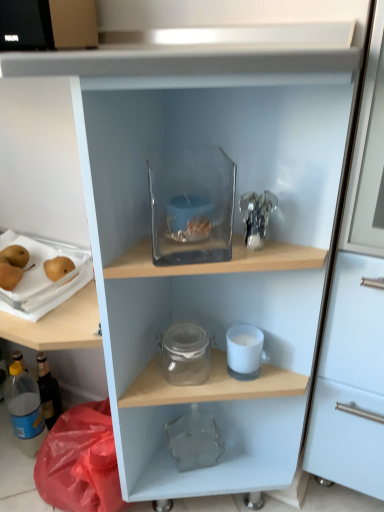
The width and height of the screenshot is (384, 512). Describe the element at coordinates (244, 351) in the screenshot. I see `white matte candle at lower center, which ranks as the 1th appliance in right-to-left order` at that location.

Based on the photo, measure the distance between smooth golden pears at left and camera.

smooth golden pears at left and camera are 35.61 inches apart.

Locate an element on the screen. The height and width of the screenshot is (512, 384). translucent plastic tray with pears at left, arranged as the second appliance when ordered from the bottom is located at coordinates (39, 280).

You are a GUI agent. You are given a task and a screenshot of the screen. Output one action in this format:
    pyautogui.click(x=<x>, y=<y>)
    Task: Click on the white matte candle at lower center, which appears as the 1th appliance when ordered from the bottom
    The image size is (384, 512).
    Given the screenshot: What is the action you would take?
    pyautogui.click(x=244, y=351)

How distant is smooth golden pears at left from translucent plastic tray with pears at left, arranged as the 2th appliance when viewed from the top?

2.57 inches.

Are smooth golden pears at left and translucent plastic tray with pears at left, acting as the 3th appliance starting from the right, making contact?

Yes, smooth golden pears at left is right next to translucent plastic tray with pears at left, acting as the 3th appliance starting from the right, and making contact.

Considering the sizes of objects smooth golden pears at left and translucent plastic tray with pears at left, arranged as the second appliance when ordered from the bottom, in the image provided, who is wider, smooth golden pears at left or translucent plastic tray with pears at left, arranged as the second appliance when ordered from the bottom,?

translucent plastic tray with pears at left, arranged as the second appliance when ordered from the bottom.

Between translucent plastic tray with pears at left, which ranks as the first appliance in left-to-right order, and transparent glass container at upper center, arranged as the 2th appliance when viewed from the left, which one appears on the left side from the viewer's perspective?

translucent plastic tray with pears at left, which ranks as the first appliance in left-to-right order.

Which of these two, translucent plastic tray with pears at left, arranged as the second appliance when ordered from the bottom, or transparent glass container at upper center, positioned as the second appliance in right-to-left order, stands taller?

transparent glass container at upper center, positioned as the second appliance in right-to-left order.

Does point (34, 321) lie in front of point (177, 170)?

No, it is not.

From a real-world perspective, does translucent plastic tray with pears at left, acting as the 3th appliance starting from the right, sit lower than transparent glass container at upper center, the 1th appliance in the top-to-bottom sequence?

Indeed, from a real-world perspective, translucent plastic tray with pears at left, acting as the 3th appliance starting from the right, is positioned beneath transparent glass container at upper center, the 1th appliance in the top-to-bottom sequence.

Looking at this image, which point is more distant from viewer, (244, 349) or (173, 331)?

The point (173, 331) is farther.

Is white matte candle at lower center, which appears as the 1th appliance when ordered from the bottom, closer to the viewer compared to transparent glass jar at middle?

No, white matte candle at lower center, which appears as the 1th appliance when ordered from the bottom, is further to the viewer.

From the image's perspective, between white matte candle at lower center, the 3th appliance positioned from the left, and transparent glass jar at middle, which one is located above?

white matte candle at lower center, the 3th appliance positioned from the left, is shown above in the image.

Which is in front, point (35, 445) or point (225, 187)?

Point (225, 187)

From a real-world perspective, is translucent plastic bottle at lower left on top of transparent glass container at upper center, arranged as the third appliance when ordered from the bottom?

Actually, translucent plastic bottle at lower left is physically below transparent glass container at upper center, arranged as the third appliance when ordered from the bottom, in the real world.

From the image's perspective, count 3rd appliances upward from the translucent plastic bottle at lower left and point to it. Please provide its 2D coordinates.

[(192, 206)]

Is translucent plastic bottle at lower left with transparent glass container at upper center, positioned as the second appliance in right-to-left order?

No, translucent plastic bottle at lower left is not touching transparent glass container at upper center, positioned as the second appliance in right-to-left order.

Visually, is transparent glass jar at middle positioned to the left or to the right of smooth golden pears at left?

transparent glass jar at middle is positioned on smooth golden pears at left's right side.

The image size is (384, 512). In order to click on fruit behind the transparent glass jar at middle in this screenshot , I will do `click(12, 265)`.

In the scene shown: From the image's perspective, which is below, transparent glass jar at middle or smooth golden pears at left?

transparent glass jar at middle is shown below in the image.

Which object is further away from the camera, transparent glass jar at middle or smooth golden pears at left?

smooth golden pears at left is more distant.

What's the angular difference between transparent glass container at upper center, positioned as the second appliance in right-to-left order, and translucent plastic bottle at lower left's facing directions?

The facing directions of transparent glass container at upper center, positioned as the second appliance in right-to-left order, and translucent plastic bottle at lower left are 33.7 degrees apart.

Considering the sizes of transparent glass container at upper center, the 1th appliance in the top-to-bottom sequence, and translucent plastic bottle at lower left in the image, is transparent glass container at upper center, the 1th appliance in the top-to-bottom sequence, taller or shorter than translucent plastic bottle at lower left?

Considering their sizes, transparent glass container at upper center, the 1th appliance in the top-to-bottom sequence, has less height than translucent plastic bottle at lower left.

From the picture: Is transparent glass container at upper center, the 1th appliance in the top-to-bottom sequence, with translucent plastic bottle at lower left?

No, transparent glass container at upper center, the 1th appliance in the top-to-bottom sequence, is not with translucent plastic bottle at lower left.

Based on the photo, is transparent glass container at upper center, arranged as the 2th appliance when viewed from the left, oriented away from translucent plastic bottle at lower left?

No, transparent glass container at upper center, arranged as the 2th appliance when viewed from the left, is not facing the opposite direction of translucent plastic bottle at lower left.

Based on their sizes in the image, would you say translucent plastic tray with pears at left, which ranks as the first appliance in left-to-right order, is bigger or smaller than translucent plastic bottle at lower left?

Clearly, translucent plastic tray with pears at left, which ranks as the first appliance in left-to-right order, is larger in size than translucent plastic bottle at lower left.

Looking at this image, does translucent plastic tray with pears at left, which ranks as the first appliance in left-to-right order, have a greater width compared to translucent plastic bottle at lower left?

Indeed, translucent plastic tray with pears at left, which ranks as the first appliance in left-to-right order, has a greater width compared to translucent plastic bottle at lower left.

There is a translucent plastic bottle at lower left. Where is `the 2nd appliance above it (from a real-world perspective)`? the 2nd appliance above it (from a real-world perspective) is located at coordinates (39, 280).

Is translucent plastic tray with pears at left, acting as the 3th appliance starting from the right, outside of translucent plastic bottle at lower left?

Yes.

You are a GUI agent. You are given a task and a screenshot of the screen. Output one action in this format:
    pyautogui.click(x=<x>, y=<y>)
    Task: Click on the fruit above the translucent plastic tray with pears at left, which ranks as the first appliance in left-to-right order (from a real-world perspective)
    
    Given the screenshot: What is the action you would take?
    tap(12, 265)

The image size is (384, 512). I want to click on the 1st appliance below the transparent glass container at upper center, positioned as the second appliance in right-to-left order (from the image's perspective), so click(x=39, y=280).

Looking at the image, which one is located closer to transparent glass container at upper center, the 1th appliance in the top-to-bottom sequence, translucent plastic tray with pears at left, acting as the 3th appliance starting from the right, or white matte candle at lower center, acting as the 3th appliance starting from the top?

Among the two, white matte candle at lower center, acting as the 3th appliance starting from the top, is located nearer to transparent glass container at upper center, the 1th appliance in the top-to-bottom sequence.

From the image, which object appears to be nearer to translucent plastic bottle at lower left, transparent glass jar at middle or smooth golden pears at left?

smooth golden pears at left is closer to translucent plastic bottle at lower left.

From the image, which object appears to be farther from transparent glass jar at middle, translucent plastic bottle at lower left or smooth golden pears at left?

translucent plastic bottle at lower left is positioned further to the anchor transparent glass jar at middle.

When comparing their distances from transparent glass container at upper center, positioned as the second appliance in right-to-left order, does transparent glass jar at middle or translucent plastic tray with pears at left, arranged as the second appliance when ordered from the bottom, seem further?

The object further to transparent glass container at upper center, positioned as the second appliance in right-to-left order, is translucent plastic tray with pears at left, arranged as the second appliance when ordered from the bottom.

When comparing their distances from smooth golden pears at left, does translucent plastic tray with pears at left, arranged as the second appliance when ordered from the bottom, or transparent glass jar at middle seem closer?

Based on the image, translucent plastic tray with pears at left, arranged as the second appliance when ordered from the bottom, appears to be nearer to smooth golden pears at left.

Consider the image. Based on their spatial positions, is translucent plastic bottle at lower left or transparent glass jar at middle further from white matte candle at lower center, which ranks as the 1th appliance in right-to-left order?

Based on the image, translucent plastic bottle at lower left appears to be further to white matte candle at lower center, which ranks as the 1th appliance in right-to-left order.

When comparing their distances from transparent glass jar at middle, does white matte candle at lower center, which ranks as the 1th appliance in right-to-left order, or smooth golden pears at left seem further?

The object further to transparent glass jar at middle is smooth golden pears at left.

In the scene shown: Looking at the image, which one is located closer to white matte candle at lower center, which ranks as the 1th appliance in right-to-left order, smooth golden pears at left or transparent glass jar at middle?

transparent glass jar at middle lies closer to white matte candle at lower center, which ranks as the 1th appliance in right-to-left order, than the other object.

The height and width of the screenshot is (512, 384). Find the location of `fruit between translucent plastic tray with pears at left, arranged as the 2th appliance when viewed from the top, and translucent plastic bottle at lower left in the up-down direction`. fruit between translucent plastic tray with pears at left, arranged as the 2th appliance when viewed from the top, and translucent plastic bottle at lower left in the up-down direction is located at coordinates (12, 265).

Identify the location of glass jar situated between smooth golden pears at left and white matte candle at lower center, acting as the 3th appliance starting from the top, from left to right. The width and height of the screenshot is (384, 512). (185, 354).

You are a GUI agent. You are given a task and a screenshot of the screen. Output one action in this format:
    pyautogui.click(x=<x>, y=<y>)
    Task: Click on the appliance between translucent plastic tray with pears at left, arranged as the second appliance when ordered from the bottom, and white matte candle at lower center, which appears as the 1th appliance when ordered from the bottom
    
    Given the screenshot: What is the action you would take?
    pyautogui.click(x=192, y=206)

Where is `appliance between smooth golden pears at left and transparent glass jar at middle`? appliance between smooth golden pears at left and transparent glass jar at middle is located at coordinates (39, 280).